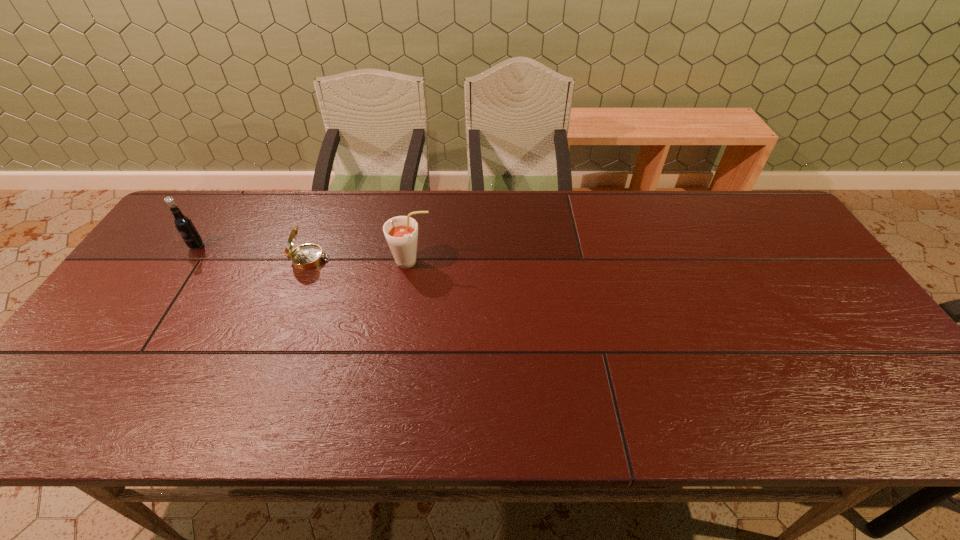
You are a GUI agent. You are given a task and a screenshot of the screen. Output one action in this format:
    pyautogui.click(x=<x>, y=<y>)
    Task: Click on the farther root beer
    This screenshot has height=540, width=960.
    Given the screenshot: What is the action you would take?
    pyautogui.click(x=183, y=224)

The image size is (960, 540). I want to click on the leftmost object, so [x=183, y=224].

You are a GUI agent. You are given a task and a screenshot of the screen. Output one action in this format:
    pyautogui.click(x=<x>, y=<y>)
    Task: Click on the rightmost object
    Image resolution: width=960 pixels, height=540 pixels.
    Given the screenshot: What is the action you would take?
    pos(401,232)

You are a GUI agent. You are given a task and a screenshot of the screen. Output one action in this format:
    pyautogui.click(x=<x>, y=<y>)
    Task: Click on the right root beer
    The image size is (960, 540).
    Given the screenshot: What is the action you would take?
    pyautogui.click(x=401, y=232)

Locate an element on the screen. compass is located at coordinates (307, 256).

Locate an element on the screen. The width and height of the screenshot is (960, 540). the second object from right to left is located at coordinates (307, 256).

Identify the location of vacant space located 0.130m on the label of the leftmost object. The image size is (960, 540). (172, 284).

Where is `vacant space located 0.270m on the drink side of the nearer root beer`? Image resolution: width=960 pixels, height=540 pixels. vacant space located 0.270m on the drink side of the nearer root beer is located at coordinates (527, 262).

You are a GUI agent. You are given a task and a screenshot of the screen. Output one action in this format:
    pyautogui.click(x=<x>, y=<y>)
    Task: Click on the vacant space situated with the dial facing the second object from left to right
    
    Given the screenshot: What is the action you would take?
    pyautogui.click(x=393, y=259)

At what (x,y) coordinates should I click in order to perform the action: click on object positioned at the left edge. Please return your answer as a coordinate pair (x, y). Image resolution: width=960 pixels, height=540 pixels. Looking at the image, I should click on (183, 224).